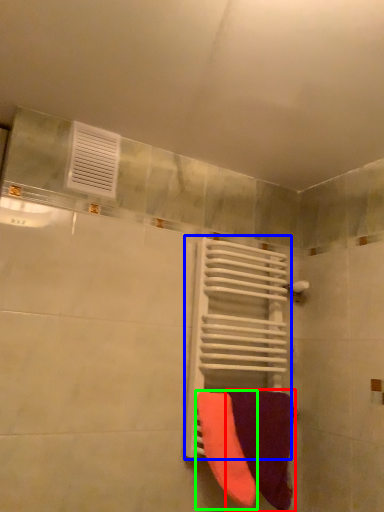
Question: Estimate the real-world distances between objects in this image. Which object is closer to towel (highlighted by a red box), radiator (highlighted by a blue box) or towel (highlighted by a green box)?

Choices:
 (A) radiator
 (B) towel

Answer: (B)